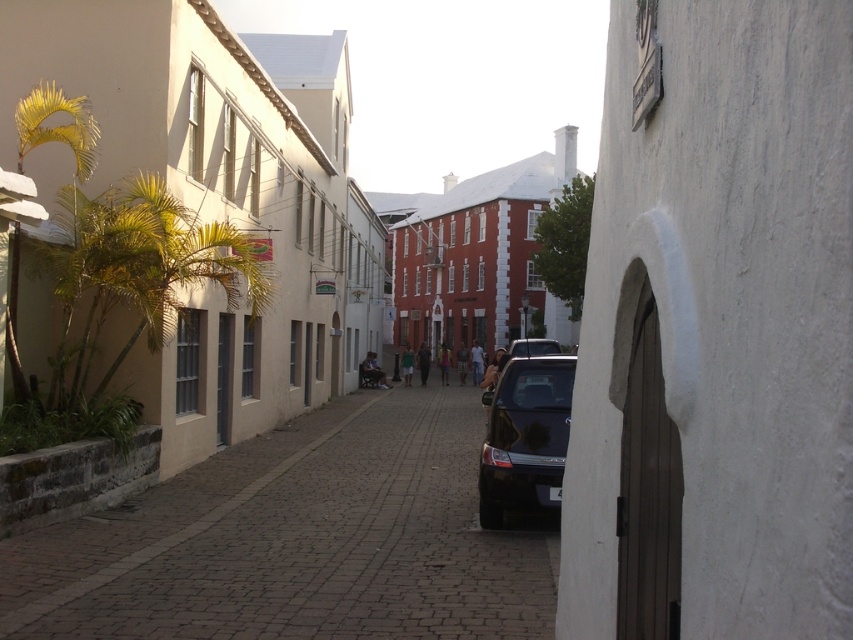
Question: Which object is farther from the camera taking this photo?

Choices:
 (A) brown cobblestone street at center
 (B) shiny dark blue car at center

Answer: (B)

Question: Does brown cobblestone street at center appear on the right side of shiny dark blue car at center?

Choices:
 (A) yes
 (B) no

Answer: (B)

Question: Which object is farther from the camera taking this photo?

Choices:
 (A) shiny dark blue car at center
 (B) brown cobblestone street at center

Answer: (A)

Question: Does brown cobblestone street at center appear over shiny dark blue car at center?

Choices:
 (A) yes
 (B) no

Answer: (B)

Question: Is brown cobblestone street at center further to the viewer compared to shiny dark blue car at center?

Choices:
 (A) yes
 (B) no

Answer: (B)